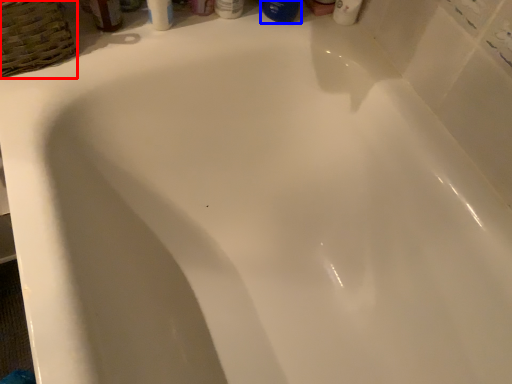
Question: Which of the following is the closest to the observer, basket (highlighted by a red box) or mouthwash (highlighted by a blue box)?

Choices:
 (A) basket
 (B) mouthwash

Answer: (A)